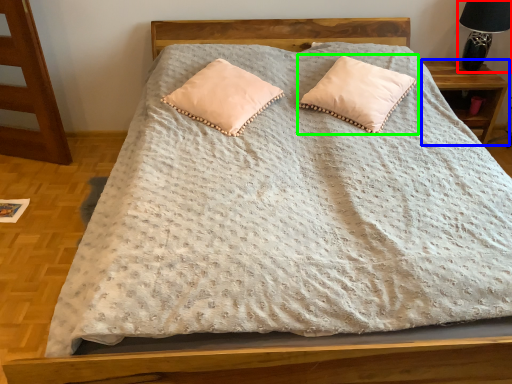
Question: Estimate the real-world distances between objects in this image. Which object is closer to table lamp (highlighted by a red box), nightstand (highlighted by a blue box) or pillow (highlighted by a green box)?

Choices:
 (A) nightstand
 (B) pillow

Answer: (A)